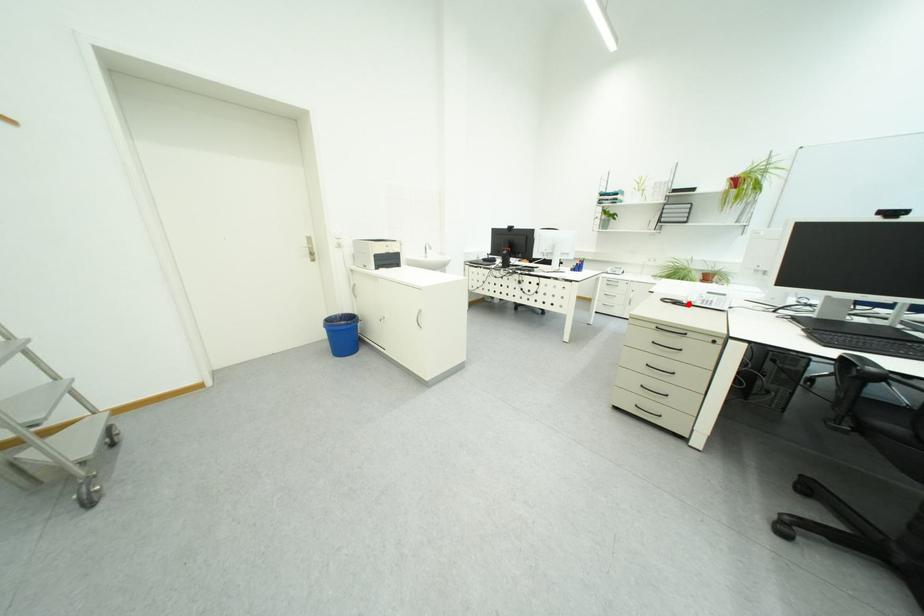
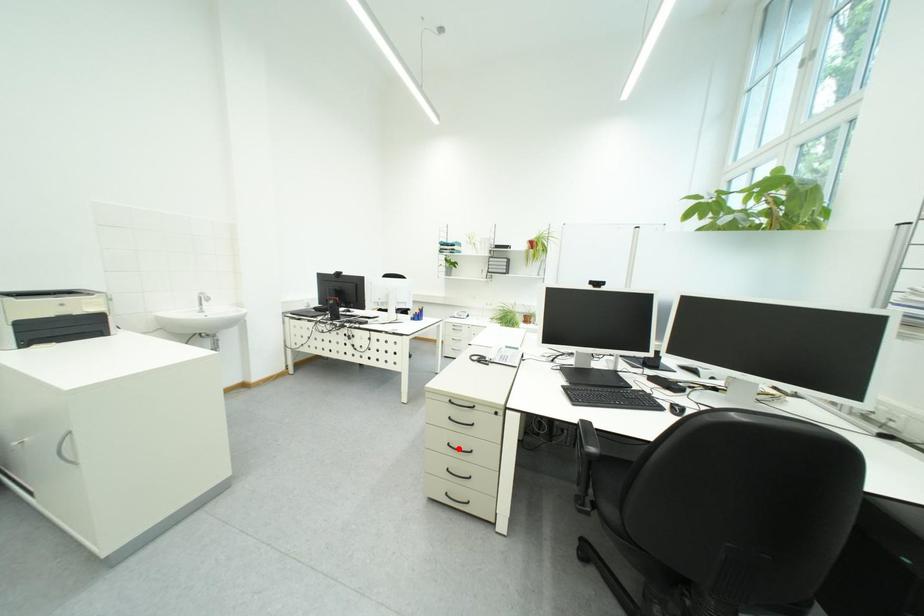
In the scene shown: I am providing you with two images of the same scene from different viewpoints. A red point is marked on the first image and another point is marked on the second image. Is the marked point in image1 the same physical position as the marked point in image2?

No